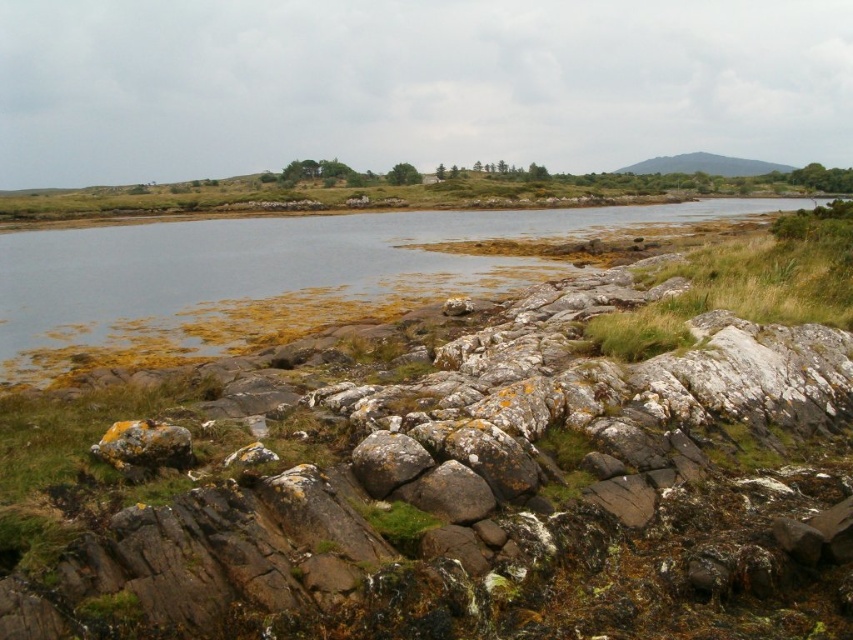
Which is more to the right, green algae-covered water at center or green grassy at right?

From the viewer's perspective, green grassy at right appears more on the right side.

Is point (231, 310) farther from viewer compared to point (809, 257)?

Yes, it is behind point (809, 257).

Where is `green algae-covered water at center`? The width and height of the screenshot is (853, 640). green algae-covered water at center is located at coordinates (277, 275).

In order to click on green algae-covered water at center in this screenshot , I will do `click(277, 275)`.

Does green algae-covered water at center appear on the right side of green leafy bush at center?

Correct, you'll find green algae-covered water at center to the right of green leafy bush at center.

What do you see at coordinates (277, 275) in the screenshot?
I see `green algae-covered water at center` at bounding box center [277, 275].

The width and height of the screenshot is (853, 640). What are the coordinates of `green algae-covered water at center` in the screenshot? It's located at (277, 275).

You are a GUI agent. You are given a task and a screenshot of the screen. Output one action in this format:
    pyautogui.click(x=<x>, y=<y>)
    Task: Click on the green algae-covered water at center
    The width and height of the screenshot is (853, 640).
    Given the screenshot: What is the action you would take?
    pyautogui.click(x=277, y=275)

Can you confirm if green grassy at right is positioned above green leafy bush at center?

No.

Does point (618, 330) come in front of point (398, 179)?

Yes, it is in front of point (398, 179).

The image size is (853, 640). Describe the element at coordinates (746, 284) in the screenshot. I see `green grassy at right` at that location.

Locate an element on the screen. The image size is (853, 640). green grassy at right is located at coordinates (746, 284).